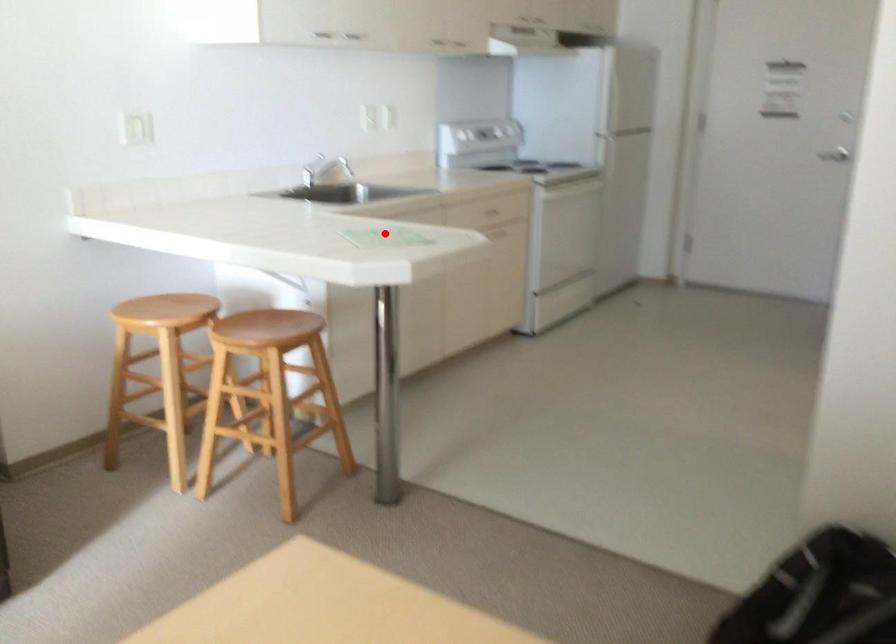
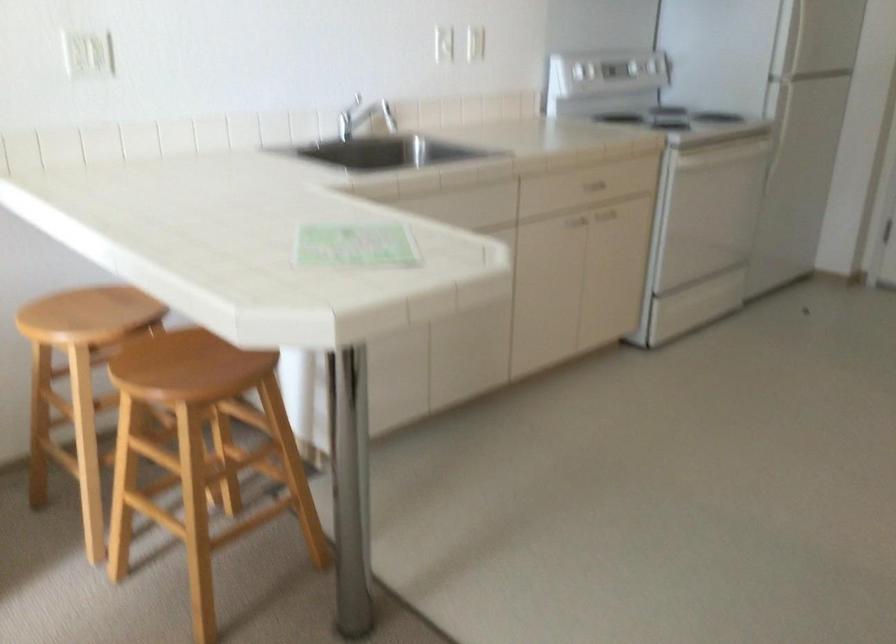
Question: A red point is marked in image1. In image2, is the corresponding 3D point closer to the camera or farther? Reply with the corresponding letter.

Choices:
 (A) The corresponding 3D point is closer.
 (B) The corresponding 3D point is farther.

Answer: (A)